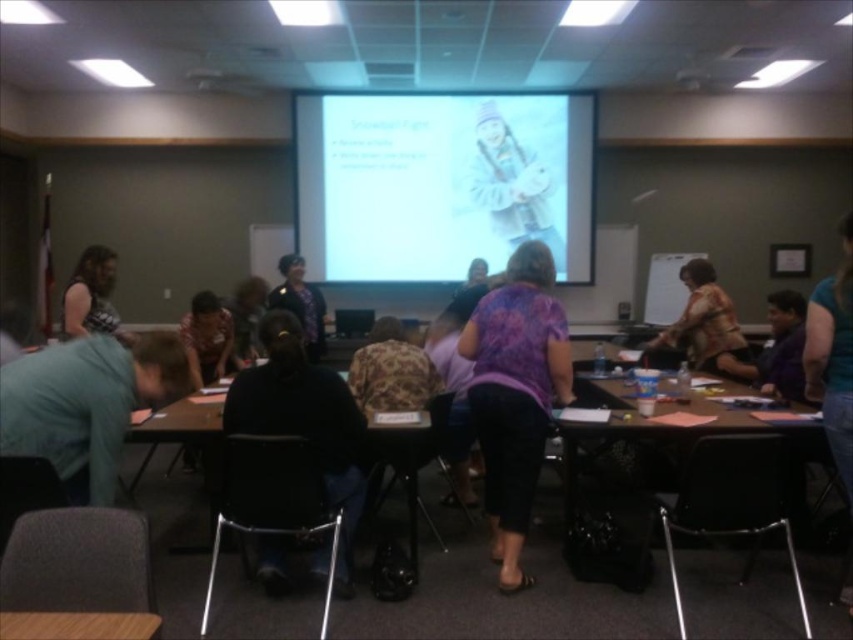
Question: Considering the relative positions of wooden table at center and dark purple shirt at center in the image provided, where is wooden table at center located with respect to dark purple shirt at center?

Choices:
 (A) above
 (B) below

Answer: (B)

Question: From the image, what is the correct spatial relationship of patterned fabric shirt at left in relation to dark purple shirt at center?

Choices:
 (A) right
 (B) left

Answer: (B)

Question: Which point appears farthest from the camera in this image?

Choices:
 (A) (712, 339)
 (B) (639, 435)

Answer: (A)

Question: Among these objects, which one is nearest to the camera?

Choices:
 (A) patterned fabric shirt at left
 (B) green matte shirt at lower left
 (C) white glossy projector screen at upper center

Answer: (B)

Question: From the image, what is the correct spatial relationship of white glossy projector screen at upper center in relation to wooden table at center?

Choices:
 (A) above
 (B) below

Answer: (A)

Question: Which point is farther from the camera taking this photo?

Choices:
 (A) (196, 320)
 (B) (512, 296)

Answer: (A)